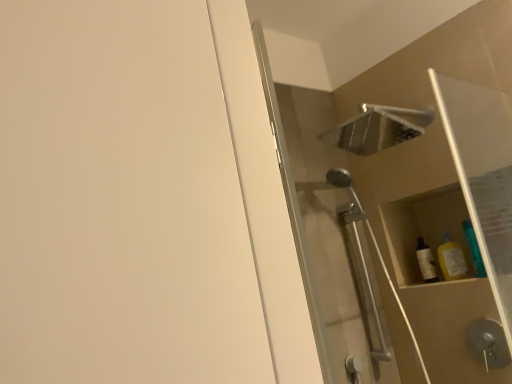
What is the approximate height of yellow translucent bottle at right?

It is 8.68 inches.

Describe the element at coordinates (474, 248) in the screenshot. I see `yellow translucent bottle at right` at that location.

The image size is (512, 384). Identify the location of yellow translucent bottle at right. (474, 248).

Consider the image. What is the approximate width of yellow translucent bottle at right?

1.74 inches.

I want to click on yellow translucent bottle at right, so click(x=474, y=248).